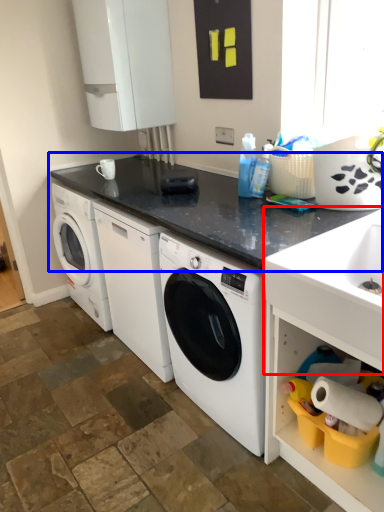
Question: Which object is closer to the camera taking this photo, sink (highlighted by a red box) or countertop (highlighted by a blue box)?

Choices:
 (A) sink
 (B) countertop

Answer: (A)